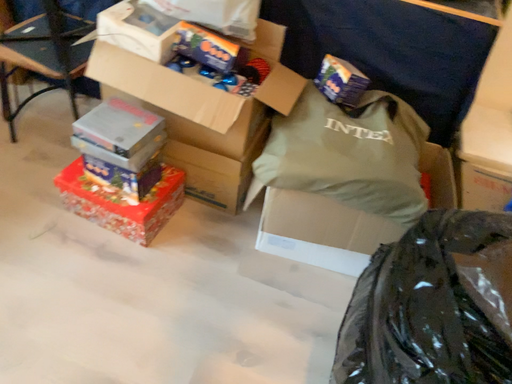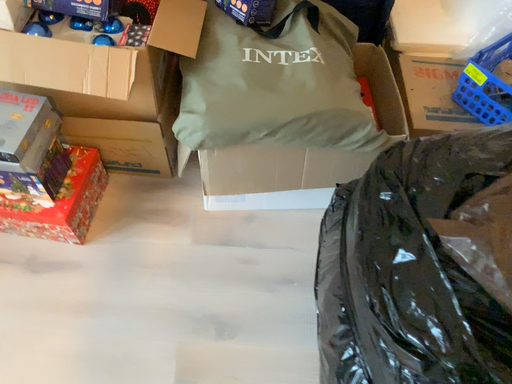
Question: Which way did the camera rotate in the video?

Choices:
 (A) rotated upward
 (B) rotated downward

Answer: (B)